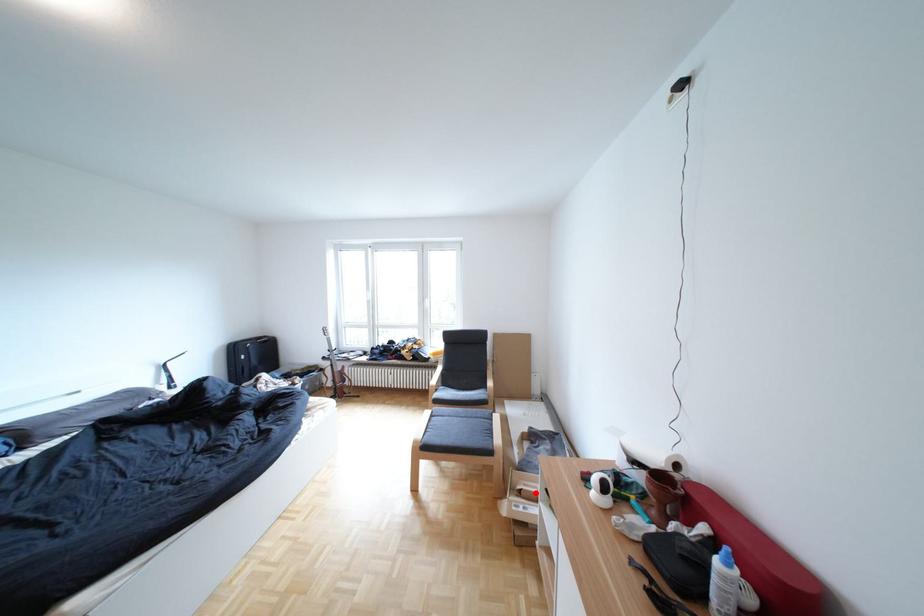
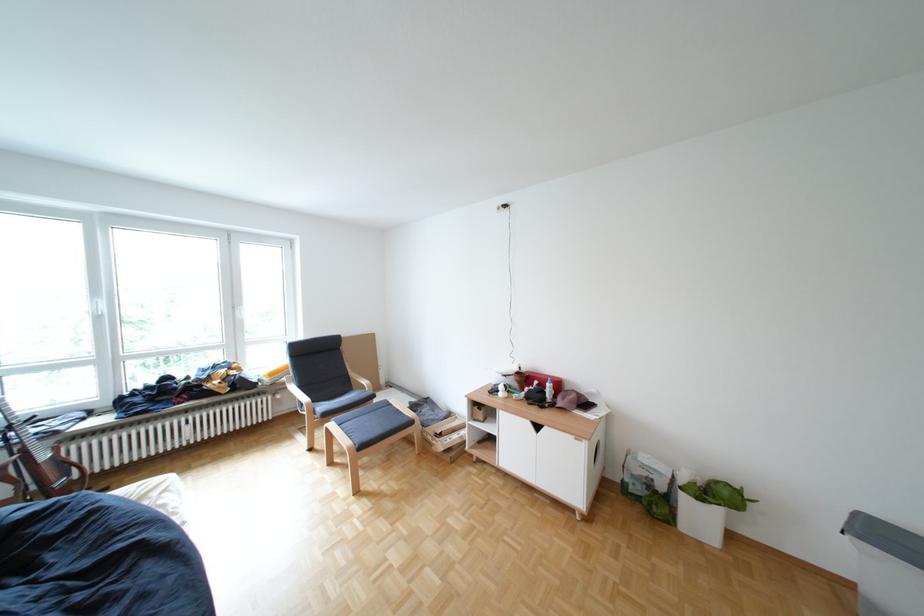
Where in the second image is the point corresponding to the highlighted location from the first image?

(456, 436)